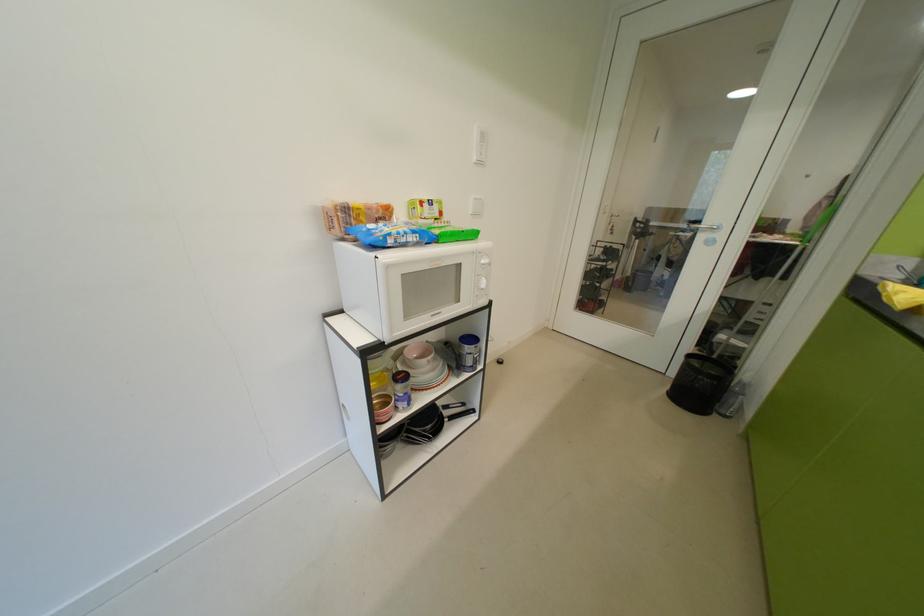
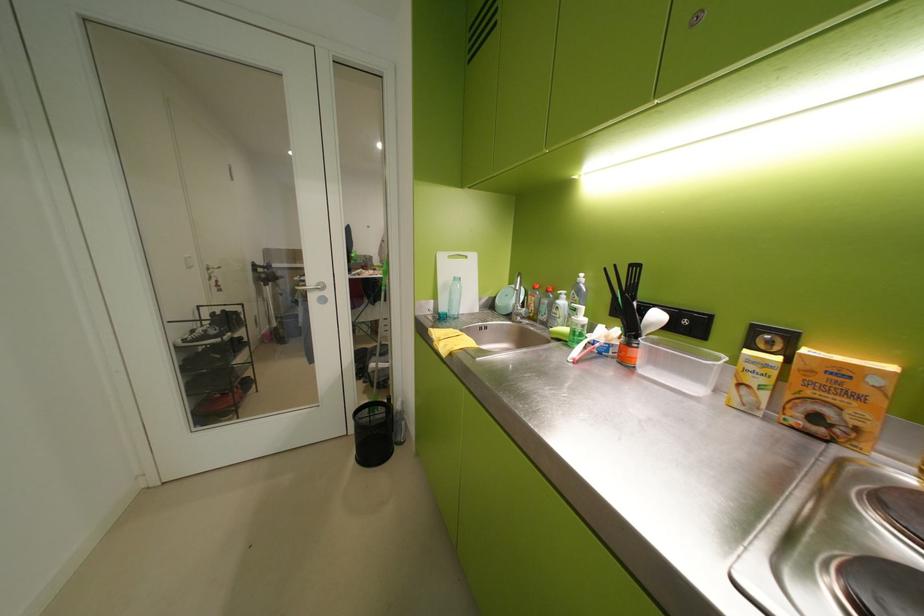
Question: How did the camera likely rotate?

Choices:
 (A) Left
 (B) Right
 (C) Up
 (D) Down

Answer: (B)